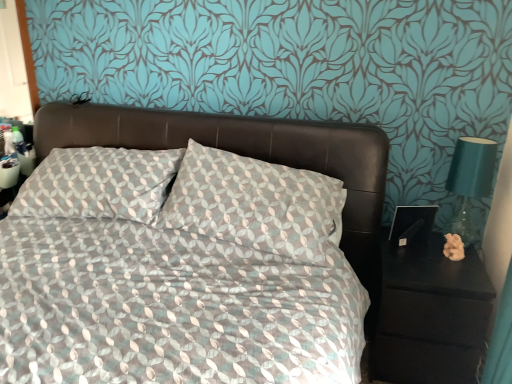
Question: Relative to black matte nightstand at right, is teal glass lamp at right in front or behind?

Choices:
 (A) front
 (B) behind

Answer: (B)

Question: In terms of height, does teal glass lamp at right look taller or shorter compared to black matte nightstand at right?

Choices:
 (A) tall
 (B) short

Answer: (B)

Question: Considering the real-world distances, which object is closest to the black matte nightstand at right?

Choices:
 (A) patterned fabric bed at center
 (B) teal glass lamp at right

Answer: (B)

Question: Which of these objects is positioned farthest from the patterned fabric bed at center?

Choices:
 (A) teal glass lamp at right
 (B) black matte nightstand at right

Answer: (A)